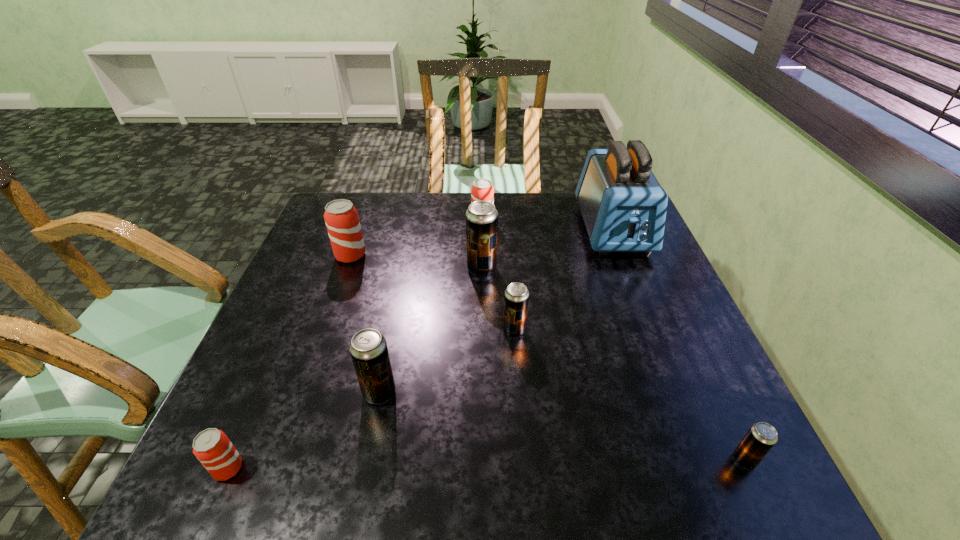
At what (x,y) coordinates should I click in order to perform the action: click on vacant point located on the left of the farthest beer can. Please return your answer as a coordinate pair (x, y). The image size is (960, 540). Looking at the image, I should click on (399, 220).

This screenshot has height=540, width=960. What are the coordinates of `blank space located 0.220m on the front of the fourth nearest beer can` in the screenshot? It's located at (521, 424).

Where is `vacant space located on the left of the rightmost black beer can`? This screenshot has height=540, width=960. vacant space located on the left of the rightmost black beer can is located at coordinates (548, 460).

Locate an element on the screen. vacant space located 0.250m on the right of the leftmost beer can is located at coordinates (381, 468).

Find the location of a particular element. The width and height of the screenshot is (960, 540). toaster that is at the far edge is located at coordinates (623, 205).

The width and height of the screenshot is (960, 540). I want to click on beer can that is positioned at the far edge, so click(482, 189).

In order to click on toaster at the right edge in this screenshot , I will do (623, 205).

The height and width of the screenshot is (540, 960). What are the coordinates of `beer can located at the right edge` in the screenshot? It's located at (761, 437).

This screenshot has height=540, width=960. I want to click on object that is positioned at the near left corner, so click(x=212, y=447).

Image resolution: width=960 pixels, height=540 pixels. In order to click on object at the far right corner in this screenshot , I will do `click(623, 205)`.